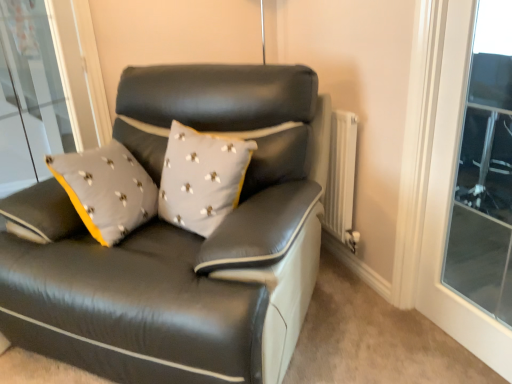
Question: Does matte black leather couch at center have a lesser width compared to transparent glass window at upper right?

Choices:
 (A) no
 (B) yes

Answer: (A)

Question: Considering the relative positions of matte black leather couch at center and transparent glass window at upper right in the image provided, is matte black leather couch at center to the right of transparent glass window at upper right from the viewer's perspective?

Choices:
 (A) yes
 (B) no

Answer: (B)

Question: Considering the relative sizes of matte black leather couch at center and transparent glass window at upper right in the image provided, is matte black leather couch at center smaller than transparent glass window at upper right?

Choices:
 (A) yes
 (B) no

Answer: (B)

Question: Does matte black leather couch at center have a greater height compared to transparent glass window at upper right?

Choices:
 (A) yes
 (B) no

Answer: (B)

Question: From a real-world perspective, does matte black leather couch at center stand above transparent glass window at upper right?

Choices:
 (A) yes
 (B) no

Answer: (B)

Question: Visually, is matte black leather couch at center positioned to the left or to the right of transparent glass window at upper right?

Choices:
 (A) left
 (B) right

Answer: (A)

Question: From the image's perspective, is matte black leather couch at center positioned above or below transparent glass window at upper right?

Choices:
 (A) above
 (B) below

Answer: (B)

Question: Is matte black leather couch at center spatially inside transparent glass window at upper right, or outside of it?

Choices:
 (A) outside
 (B) inside

Answer: (A)

Question: From a real-world perspective, is matte black leather couch at center physically located above or below transparent glass window at upper right?

Choices:
 (A) below
 (B) above

Answer: (A)

Question: Considering the positions of transparent glass window at upper right and white textured radiator at right in the image, is transparent glass window at upper right bigger or smaller than white textured radiator at right?

Choices:
 (A) big
 (B) small

Answer: (B)

Question: From a real-world perspective, is transparent glass window at upper right above or below white textured radiator at right?

Choices:
 (A) above
 (B) below

Answer: (A)

Question: Considering the positions of point (497, 210) and point (333, 205), is point (497, 210) closer or farther from the camera than point (333, 205)?

Choices:
 (A) closer
 (B) farther

Answer: (B)

Question: Considering the positions of transparent glass window at upper right and white textured radiator at right in the image, is transparent glass window at upper right taller or shorter than white textured radiator at right?

Choices:
 (A) short
 (B) tall

Answer: (B)

Question: In the image, is white textured radiator at right on the left side or the right side of transparent glass window at upper right?

Choices:
 (A) left
 (B) right

Answer: (A)

Question: In the image, is white textured radiator at right positioned in front of or behind transparent glass window at upper right?

Choices:
 (A) behind
 (B) front

Answer: (A)